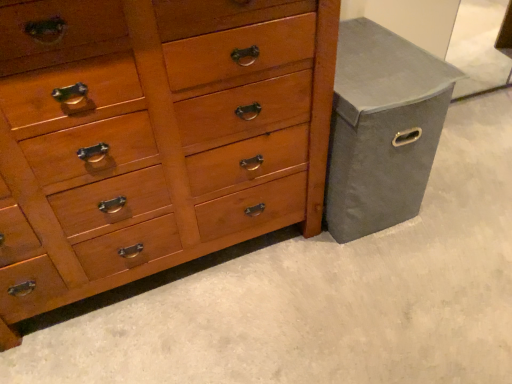
Question: Is matte gray fabric bin at right touching shiny wood chest of drawers at center?

Choices:
 (A) yes
 (B) no

Answer: (B)

Question: Considering the relative positions of matte gray fabric bin at right and shiny wood chest of drawers at center in the image provided, is matte gray fabric bin at right to the right of shiny wood chest of drawers at center from the viewer's perspective?

Choices:
 (A) yes
 (B) no

Answer: (A)

Question: Does matte gray fabric bin at right lie in front of shiny wood chest of drawers at center?

Choices:
 (A) yes
 (B) no

Answer: (B)

Question: Can you confirm if matte gray fabric bin at right is wider than shiny wood chest of drawers at center?

Choices:
 (A) no
 (B) yes

Answer: (B)

Question: From the image's perspective, would you say matte gray fabric bin at right is shown under shiny wood chest of drawers at center?

Choices:
 (A) no
 (B) yes

Answer: (A)

Question: Is matte gray fabric bin at right positioned behind shiny wood chest of drawers at center?

Choices:
 (A) yes
 (B) no

Answer: (A)

Question: Does shiny wood chest of drawers at center appear on the left side of matte gray fabric bin at right?

Choices:
 (A) no
 (B) yes

Answer: (B)

Question: Does shiny wood chest of drawers at center have a lesser width compared to matte gray fabric bin at right?

Choices:
 (A) no
 (B) yes

Answer: (B)

Question: Can you confirm if shiny wood chest of drawers at center is wider than matte gray fabric bin at right?

Choices:
 (A) yes
 (B) no

Answer: (B)

Question: Is the position of shiny wood chest of drawers at center more distant than that of matte gray fabric bin at right?

Choices:
 (A) no
 (B) yes

Answer: (A)

Question: Is shiny wood chest of drawers at center smaller than matte gray fabric bin at right?

Choices:
 (A) yes
 (B) no

Answer: (B)

Question: From a real-world perspective, is shiny wood chest of drawers at center below matte gray fabric bin at right?

Choices:
 (A) no
 (B) yes

Answer: (A)

Question: In terms of width, does matte gray fabric bin at right look wider or thinner when compared to shiny wood chest of drawers at center?

Choices:
 (A) thin
 (B) wide

Answer: (B)